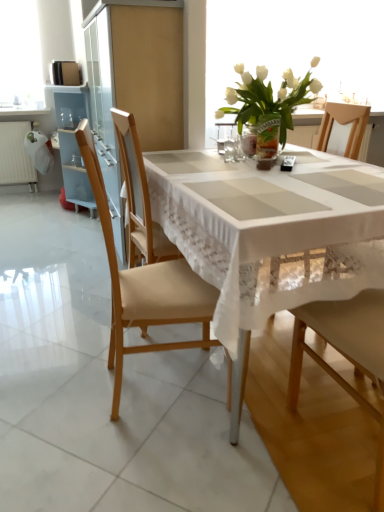
Find the location of a particular element. The width and height of the screenshot is (384, 512). unoccupied region to the right of clear glass vase at center, the second tableware viewed from the left is located at coordinates (283, 159).